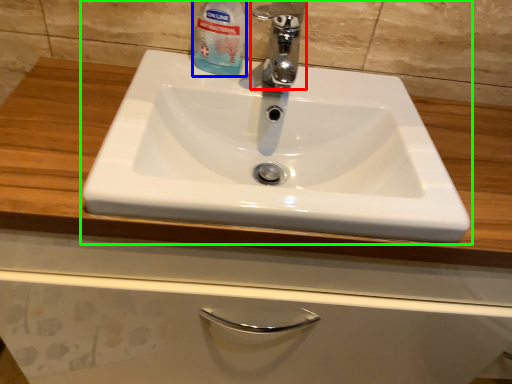
Question: Which object is the farthest from tap (highlighted by a red box)? Choose among these: cleaning product (highlighted by a blue box) or sink (highlighted by a green box).

Choices:
 (A) cleaning product
 (B) sink

Answer: (B)